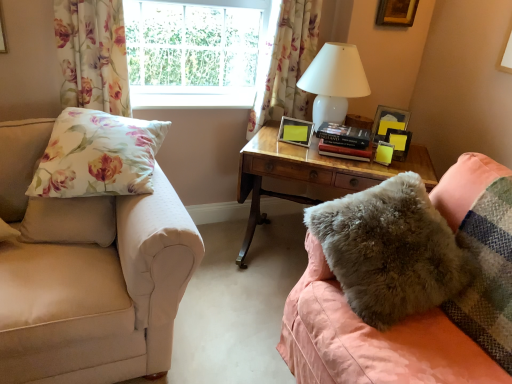
At what (x,y) coordinates should I click in order to perform the action: click on vacant position to the left of matte wooden picture frame at center, which is the third picture frame from top to bottom. Please return your answer as a coordinate pair (x, y). This screenshot has height=384, width=512. Looking at the image, I should click on (277, 139).